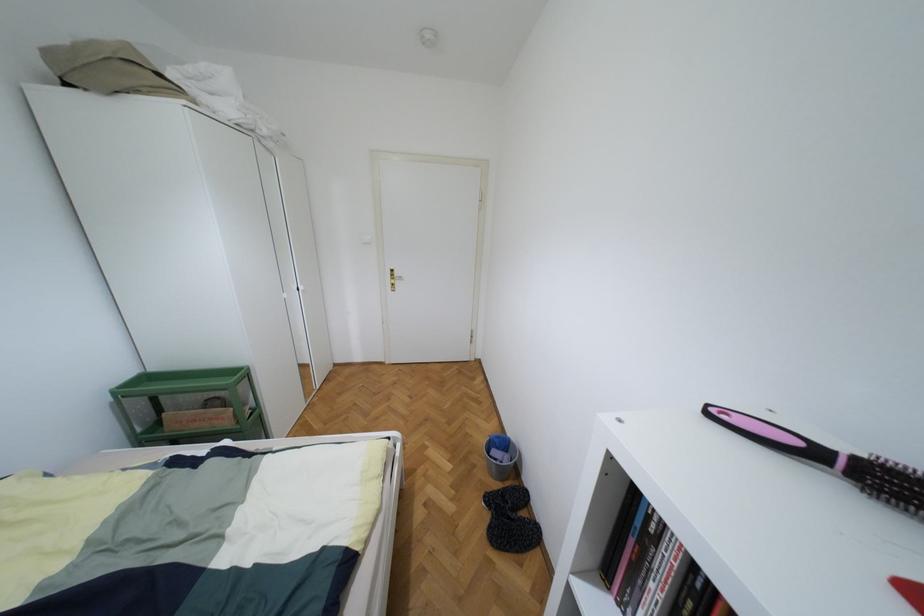
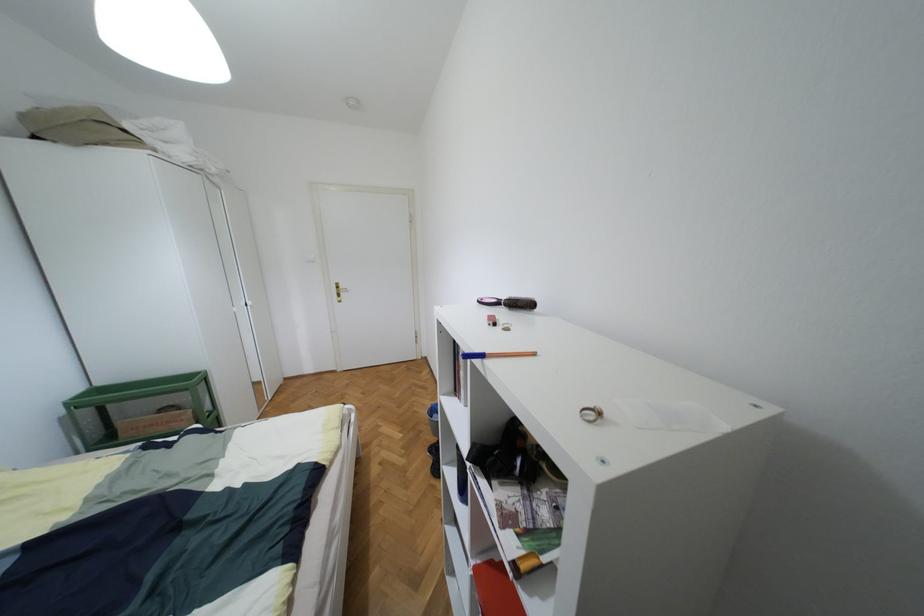
Question: How did the camera likely rotate?

Choices:
 (A) Left
 (B) Right
 (C) Up
 (D) Down

Answer: (B)